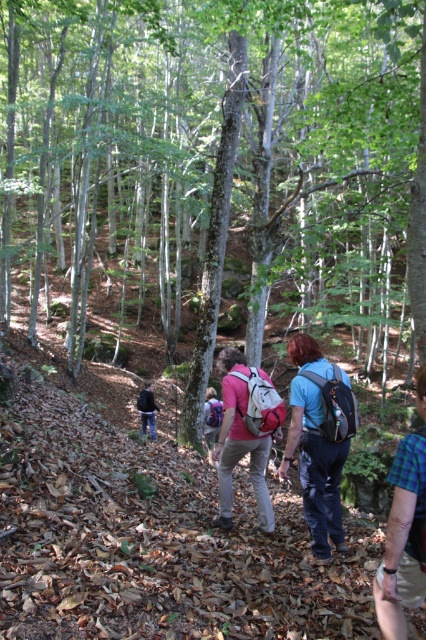
Image resolution: width=426 pixels, height=640 pixels. Describe the element at coordinates (218, 161) in the screenshot. I see `rough bark tree at center` at that location.

Can you confirm if rough bark tree at center is positioned above matte blue backpack at center?

Indeed, rough bark tree at center is positioned over matte blue backpack at center.

Find the location of a particular element. The image size is (426, 640). rough bark tree at center is located at coordinates coord(218,161).

Image resolution: width=426 pixels, height=640 pixels. I want to click on rough bark tree at center, so click(x=218, y=161).

Is matte blue backpack at center bigger than matte pink backpack at center?

Actually, matte blue backpack at center might be smaller than matte pink backpack at center.

Which of these two, matte blue backpack at center or matte pink backpack at center, stands taller?

Standing taller between the two is matte blue backpack at center.

I want to click on matte blue backpack at center, so coord(319,440).

Find the location of `matte blue backpack at center`. matte blue backpack at center is located at coordinates pos(319,440).

Is point (74, 144) behind point (386, 563)?

That is True.

The image size is (426, 640). I want to click on rough bark tree at center, so click(x=218, y=161).